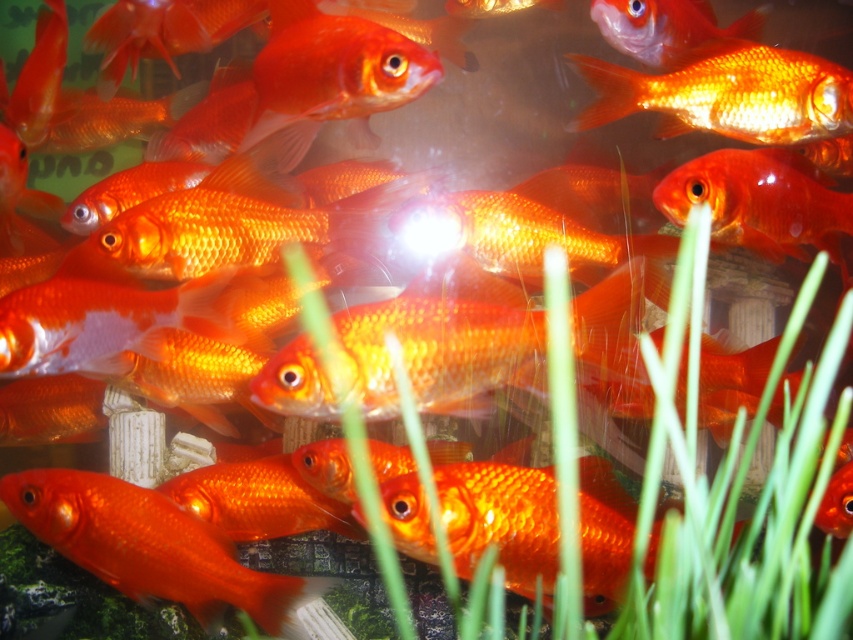
You are a goldfish in the aquarium and want to swim from the point at coordinates point (80, 524) to the point at coordinates point (657, 104). Which direction should you swim to get closer to your destination?

To get closer to the destination point (657, 104), you should swim away from the viewer since point (80, 524) is closer to the viewer than point (657, 104).

You are a goldfish in the aquarium and you want to swim to the point marked at coordinates (x=152, y=547). What object is located at that point?

The point marked at coordinates 0.859, 0.179 is on a shiny orange goldfish at center.